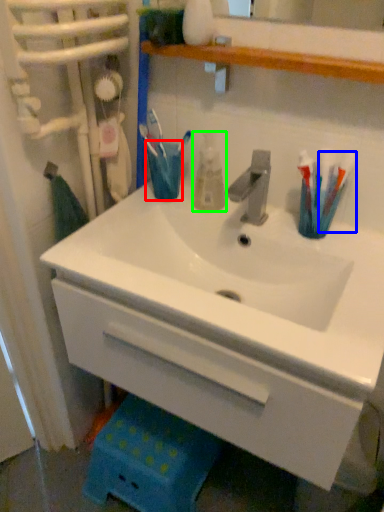
Question: Which object is the closest to the turquoise (highlighted by a red box)? Choose among these: toothbrush (highlighted by a blue box) or mouthwash (highlighted by a green box).

Choices:
 (A) toothbrush
 (B) mouthwash

Answer: (B)